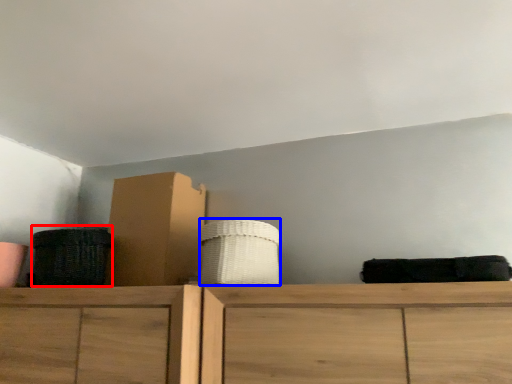
Question: Which object is further to the camera taking this photo, basket (highlighted by a red box) or basket (highlighted by a blue box)?

Choices:
 (A) basket
 (B) basket

Answer: (A)